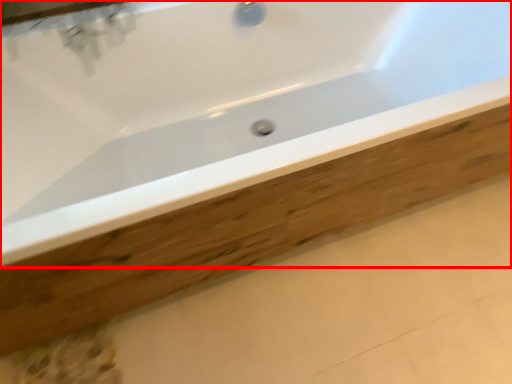
Question: From the image's perspective, considering the relative positions of bathtub (annotated by the red box) and plank in the image provided, where is bathtub (annotated by the red box) located with respect to the staircase?

Choices:
 (A) above
 (B) below

Answer: (A)